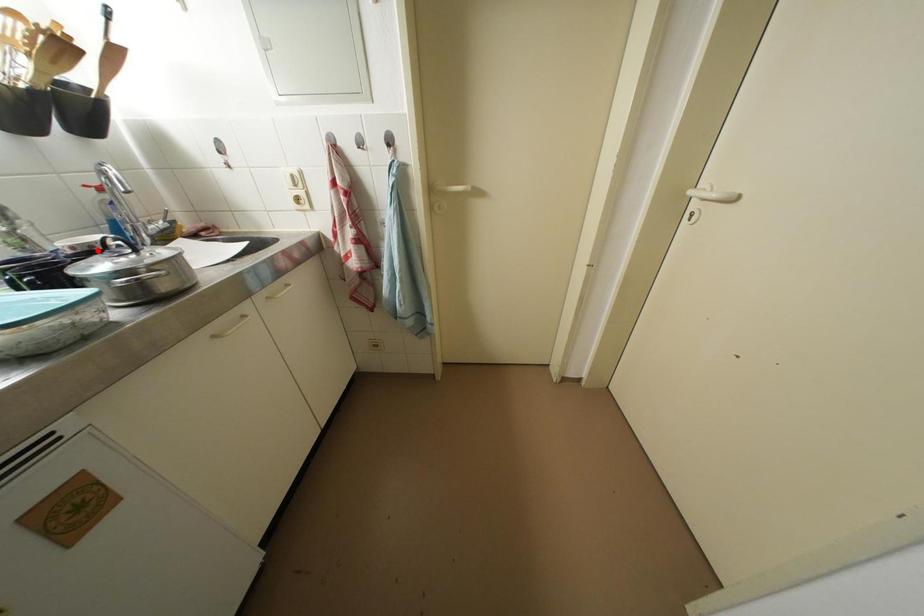
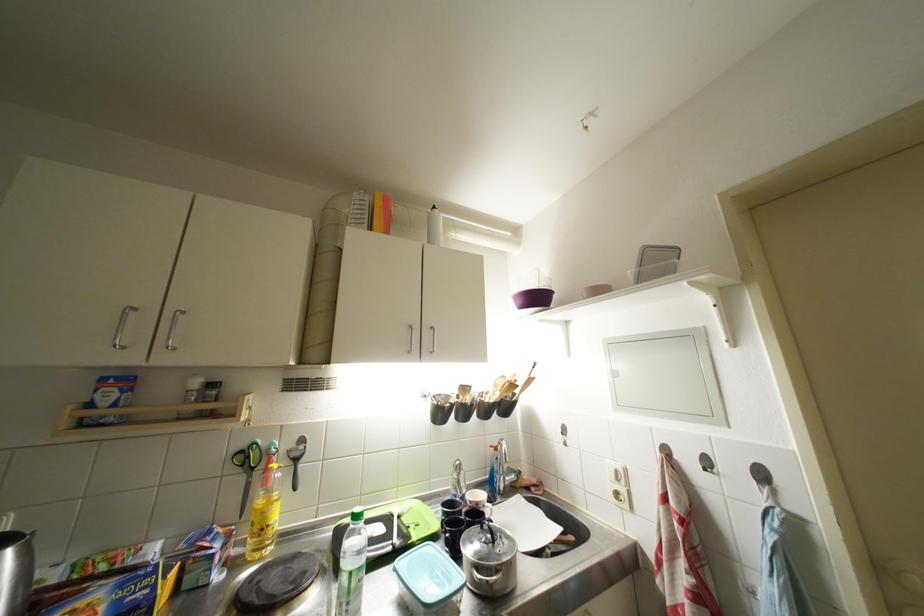
Locate, in the second image, the point that corresponds to the highlighted location in the first image.

(483, 508)